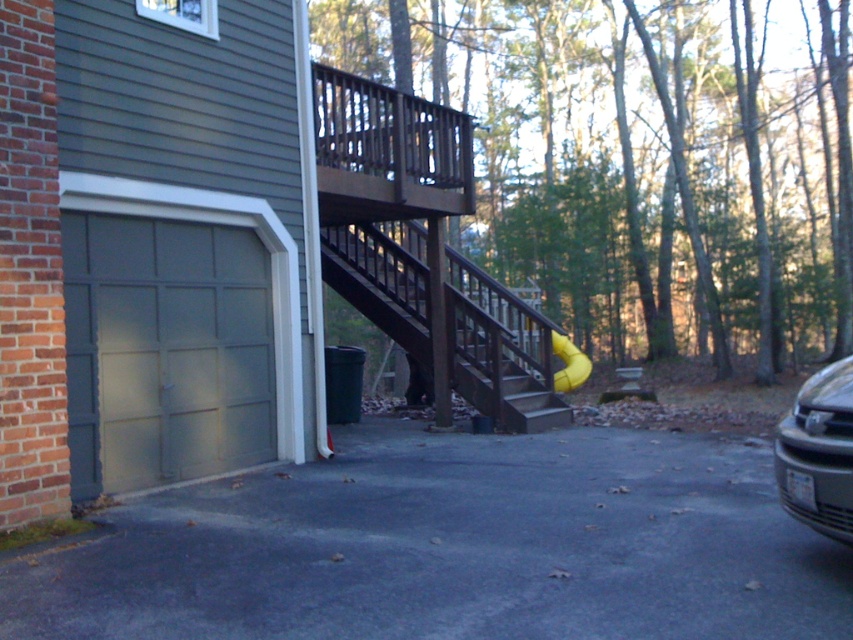
You are standing at the driveway and want to reach the deck. There are brown wooden stairs at center and a yellow rubber slide at center in your way. Which object should you step on first to get to the deck?

You should step on the brown wooden stairs at center first because it is closer to you than the yellow rubber slide at center.

You are standing on the deck and want to retrieve the yellow rubber slide at center. However, there is a silver metallic car at right blocking your path. Can you walk around the car to reach the slide?

The silver metallic car at right is to the right of the yellow rubber slide at center, so you can walk around the car to the left side to reach the slide.